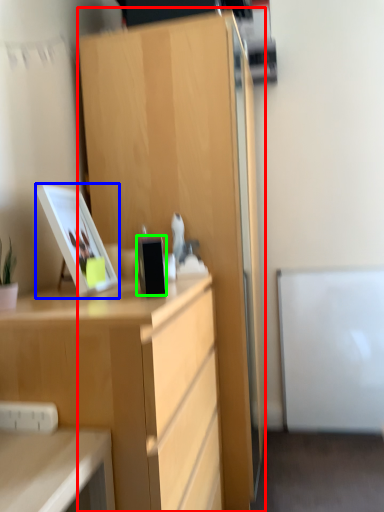
Question: Which object is the closest to the cabinetry (highlighted by a red box)? Choose among these: picture frame (highlighted by a blue box) or appliance (highlighted by a green box).

Choices:
 (A) picture frame
 (B) appliance

Answer: (A)